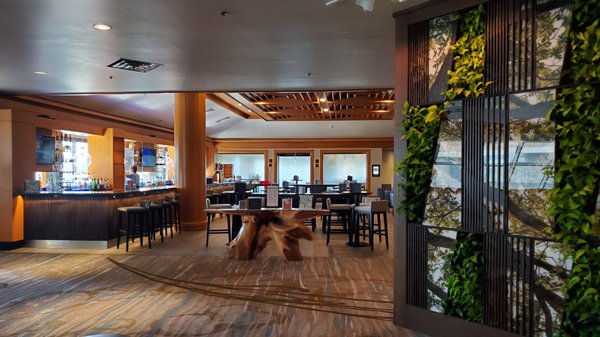
This screenshot has height=337, width=600. I want to click on celling vent, so click(x=136, y=66).